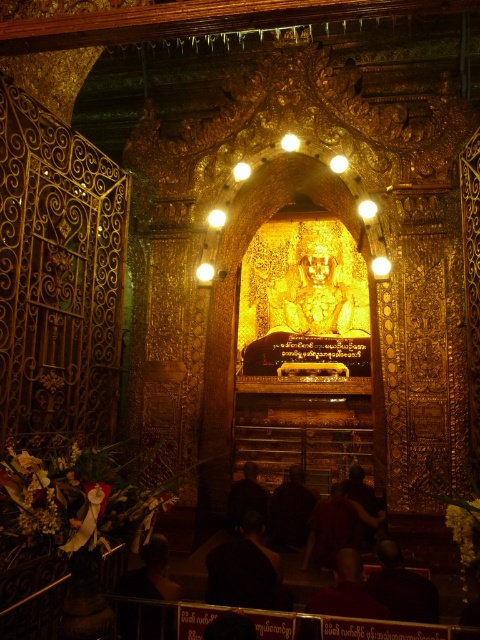
Who is taller, black matte person at lower center or dark brown fabric at center?

dark brown fabric at center

Is point (252, 589) farther from camera compared to point (292, 529)?

No.

Who is more forward, (251, 531) or (278, 531)?

Point (251, 531) is more forward.

Locate an element on the screen. Image resolution: width=480 pixels, height=640 pixels. black matte person at lower center is located at coordinates (247, 570).

Does dark brown fabric at lower center appear under dark brown fabric at center?

Correct, dark brown fabric at lower center is located below dark brown fabric at center.

Does dark brown fabric at lower center have a greater height compared to dark brown fabric at center?

No, dark brown fabric at lower center is not taller than dark brown fabric at center.

What do you see at coordinates (402, 588) in the screenshot? The width and height of the screenshot is (480, 640). I see `dark brown fabric at lower center` at bounding box center [402, 588].

Locate an element on the screen. The width and height of the screenshot is (480, 640). dark brown fabric at lower center is located at coordinates (402, 588).

Can you confirm if dark red fabric at center is positioned to the left of dark brown fabric at lower center?

Correct, you'll find dark red fabric at center to the left of dark brown fabric at lower center.

Measure the distance between point (x=350, y=540) and camera.

The distance of point (x=350, y=540) from camera is 115.57 feet.

I want to click on dark red fabric at center, so click(x=336, y=525).